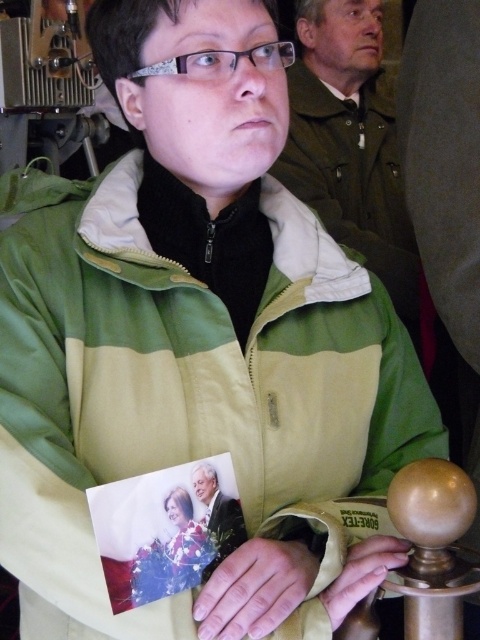
Question: Is green/yellow nylon jacket at center to the left of green matte jacket at upper center from the viewer's perspective?

Choices:
 (A) no
 (B) yes

Answer: (B)

Question: Considering the real-world distances, which object is closest to the matte gold handle at lower center?

Choices:
 (A) smooth skin hand at center
 (B) green/yellow nylon jacket at center
 (C) green matte jacket at upper center

Answer: (A)

Question: Can you confirm if smooth skin hand at center is positioned below matte gold handle at lower center?

Choices:
 (A) yes
 (B) no

Answer: (A)

Question: Which object is the closest to the green matte jacket at upper center?

Choices:
 (A) smooth skin hand at center
 (B) matte gold handle at lower center

Answer: (A)

Question: Does green/yellow nylon jacket at center lie behind matte gold handle at lower center?

Choices:
 (A) yes
 (B) no

Answer: (B)

Question: Among these points, which one is nearest to the camera?

Choices:
 (A) (222, 392)
 (B) (354, 548)
 (C) (320, 209)
 (D) (286, 611)

Answer: (D)